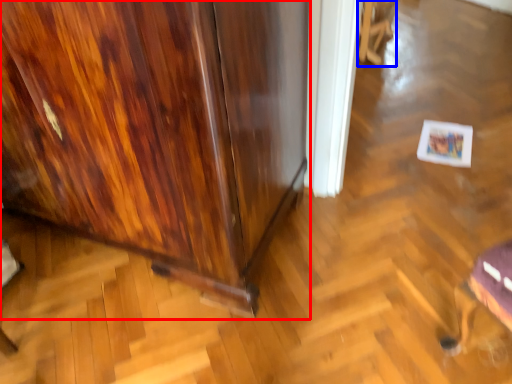
Question: Which object appears closest to the camera in this image, furniture (highlighted by a red box) or swivel chair (highlighted by a blue box)?

Choices:
 (A) furniture
 (B) swivel chair

Answer: (A)